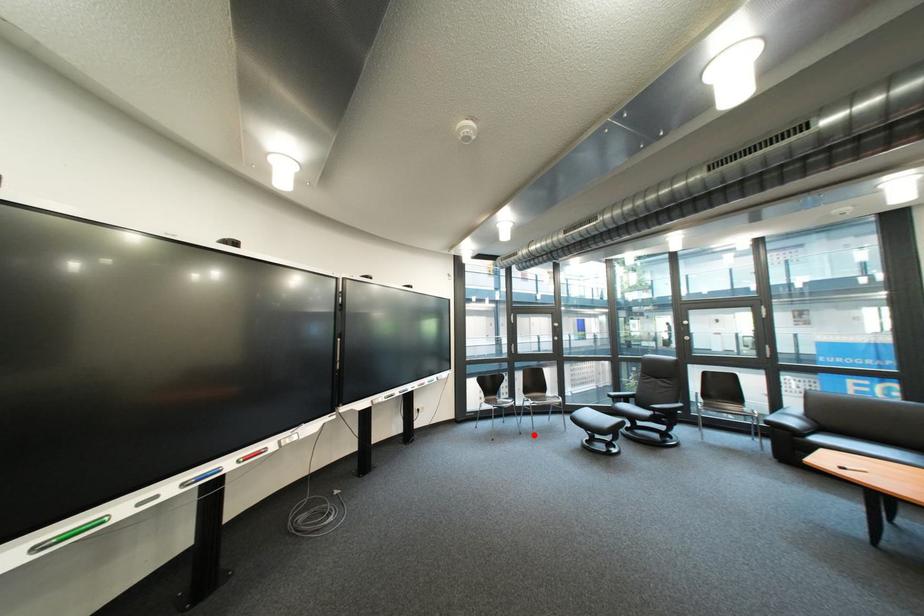
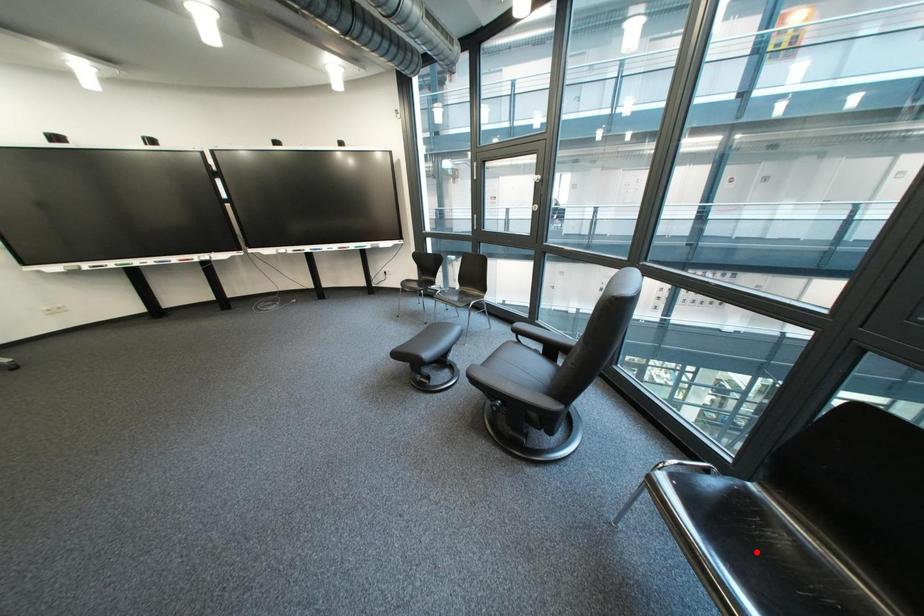
I am providing you with two images of the same scene from different viewpoints. A red point is marked on the first image and another point is marked on the second image. Is the marked point in image1 the same physical position as the marked point in image2?

No